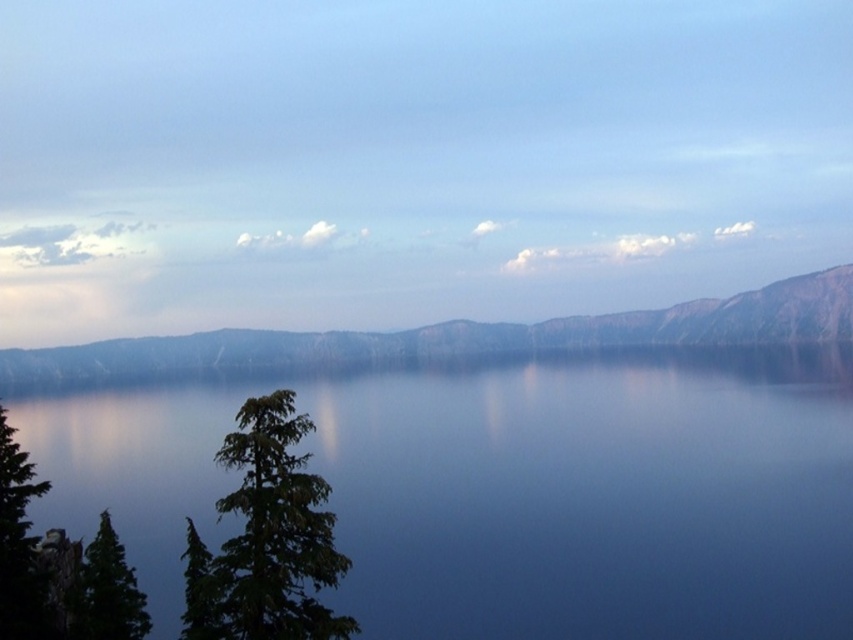
You are standing at the edge of the lake and want to take a photo of the rugged stone mountain at upper center and the green matte tree at lower left. Which object will appear smaller in the photo?

The green matte tree at lower left will appear smaller in the photo because it is farther away from the camera than the rugged stone mountain at upper center.

You are an artist planning to paint this landscape. You want to emphasize the blue reflective water at center and the rugged stone mountain at upper center. Which object should you paint first if you want to follow the rule of painting larger objects before smaller ones?

The blue reflective water at center should be painted first because it has a larger size compared to the rugged stone mountain at upper center, following the rule of painting larger objects before smaller ones.

You are standing at the point labeled as point (x=339, y=355) in the image. A boat is anchored 100 feet away from you. Can you see the boat from your current position?

The boat anchored 100 feet away from point (x=339, y=355) would be within the visible range since the distance between you and the point is 1362.50 feet, which is much greater than 100 feet. Therefore, the boat should be visible.